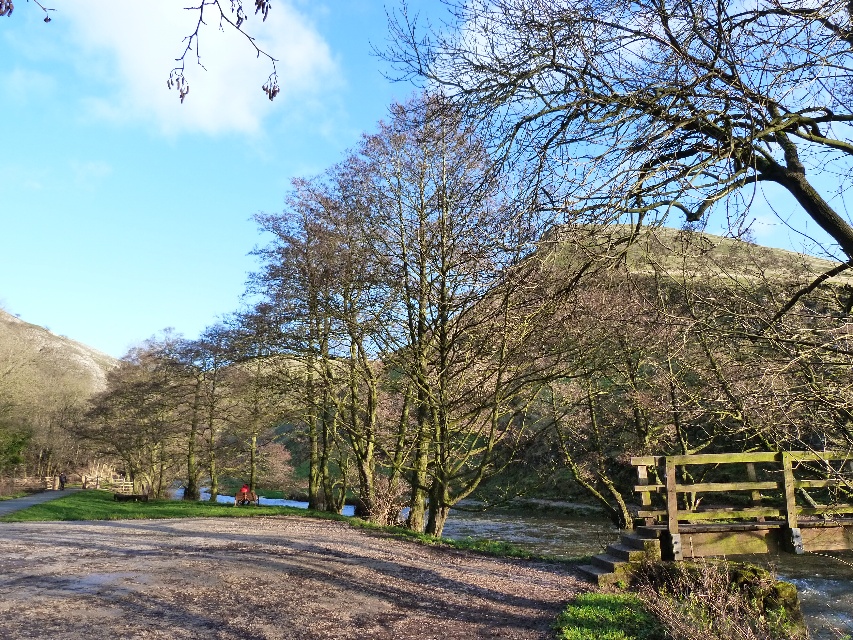
You are standing at the starting point of the damp gravel path at lower center. If you walk straight ahead, which direction will you be facing relative to the wooden bridge over the small stream?

The damp gravel path at lower center leads towards the wooden bridge over the small stream, so walking straight ahead will take you in the direction of the bridge.

You are standing at the starting point of the damp gravel path at lower center and want to reach the wooden bridge over the stream. The path is 7.35 meters long. If you walk at a speed of 1.5 meters per second, how many seconds will it take you to reach the bridge?

The damp gravel path at lower center is 7.35 meters away from the viewer. At a walking speed of 1.5 meters per second, it will take 7.35 divided by 1.5, which equals approximately 4.9 seconds to reach the bridge.

You are standing at the wooden bridge and want to walk to the point marked as point (x=32, y=595). However, there is an obstacle at point (x=41, y=499). Can you safely walk around the obstacle to reach your destination?

Yes, you can safely walk around the obstacle because point (x=32, y=595) is closer to the viewer than point (x=41, y=499), meaning the destination is nearer and the obstacle is further away, allowing a clear path around it.